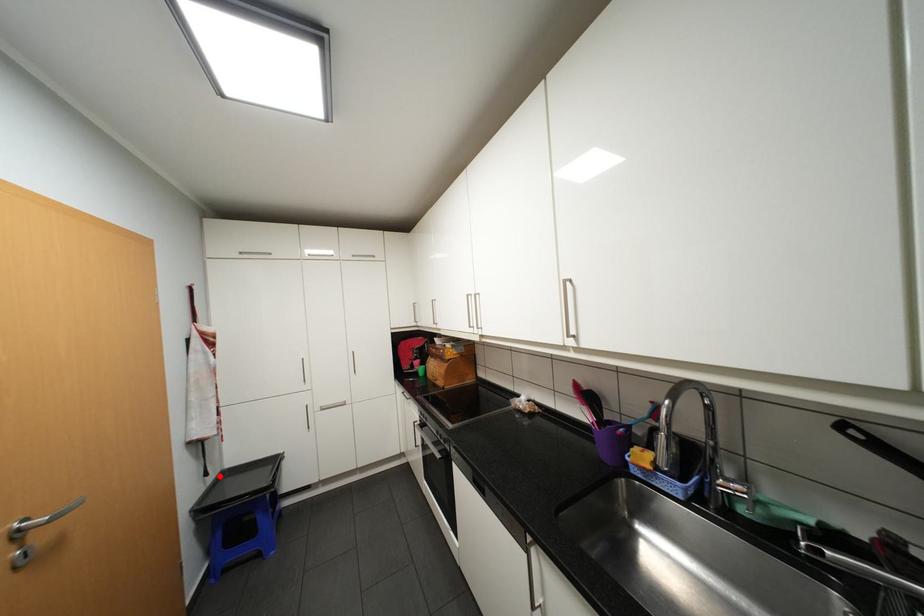
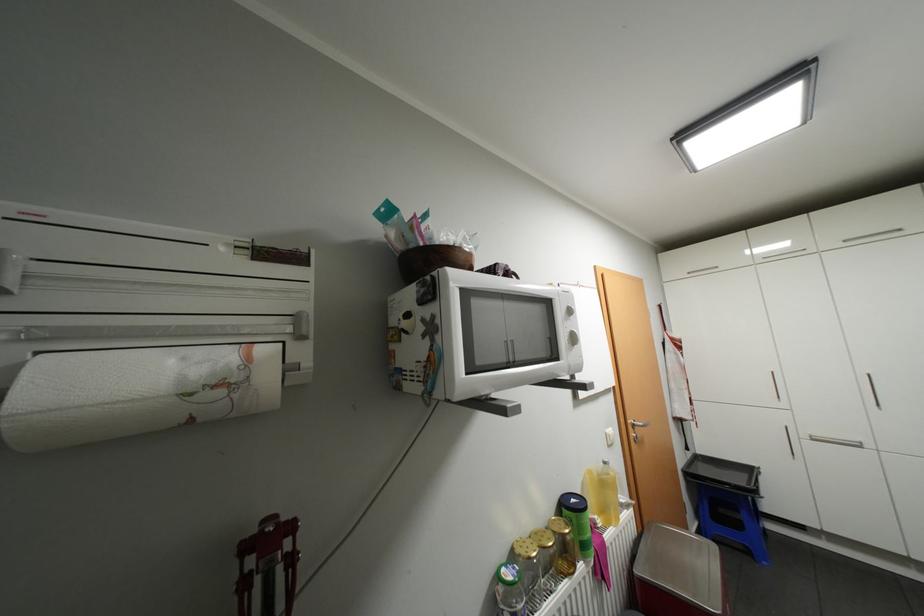
Find the pixel in the second image that matches the highlighted location in the first image.

(697, 453)